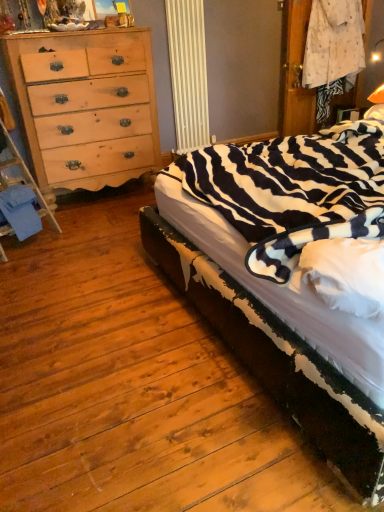
Question: Is zebra-patterned fabric at right aimed at natural wood dresser at left?

Choices:
 (A) yes
 (B) no

Answer: (B)

Question: Is zebra-patterned fabric at right completely or partially outside of natural wood dresser at left?

Choices:
 (A) yes
 (B) no

Answer: (A)

Question: Is zebra-patterned fabric at right wider than natural wood dresser at left?

Choices:
 (A) yes
 (B) no

Answer: (A)

Question: Is zebra-patterned fabric at right further to the viewer compared to natural wood dresser at left?

Choices:
 (A) no
 (B) yes

Answer: (A)

Question: Is zebra-patterned fabric at right positioned far away from natural wood dresser at left?

Choices:
 (A) no
 (B) yes

Answer: (B)

Question: Is blue fabric at lower left inside or outside of natural wood dresser at left?

Choices:
 (A) outside
 (B) inside

Answer: (A)

Question: Relative to natural wood dresser at left, is blue fabric at lower left in front or behind?

Choices:
 (A) front
 (B) behind

Answer: (A)

Question: In terms of size, does blue fabric at lower left appear bigger or smaller than natural wood dresser at left?

Choices:
 (A) big
 (B) small

Answer: (B)

Question: From a real-world perspective, is blue fabric at lower left above or below natural wood dresser at left?

Choices:
 (A) below
 (B) above

Answer: (A)

Question: From a real-world perspective, is natural wood dresser at left physically located above or below blue fabric at lower left?

Choices:
 (A) above
 (B) below

Answer: (A)

Question: Would you say natural wood dresser at left is inside or outside blue fabric at lower left?

Choices:
 (A) inside
 (B) outside

Answer: (B)

Question: Considering the positions of natural wood dresser at left and blue fabric at lower left in the image, is natural wood dresser at left taller or shorter than blue fabric at lower left?

Choices:
 (A) short
 (B) tall

Answer: (B)

Question: From the image's perspective, is natural wood dresser at left positioned above or below blue fabric at lower left?

Choices:
 (A) above
 (B) below

Answer: (A)

Question: Is zebra-patterned fabric at right wider or thinner than natural wood dresser at left?

Choices:
 (A) wide
 (B) thin

Answer: (A)

Question: From a real-world perspective, is zebra-patterned fabric at right positioned above or below natural wood dresser at left?

Choices:
 (A) below
 (B) above

Answer: (A)